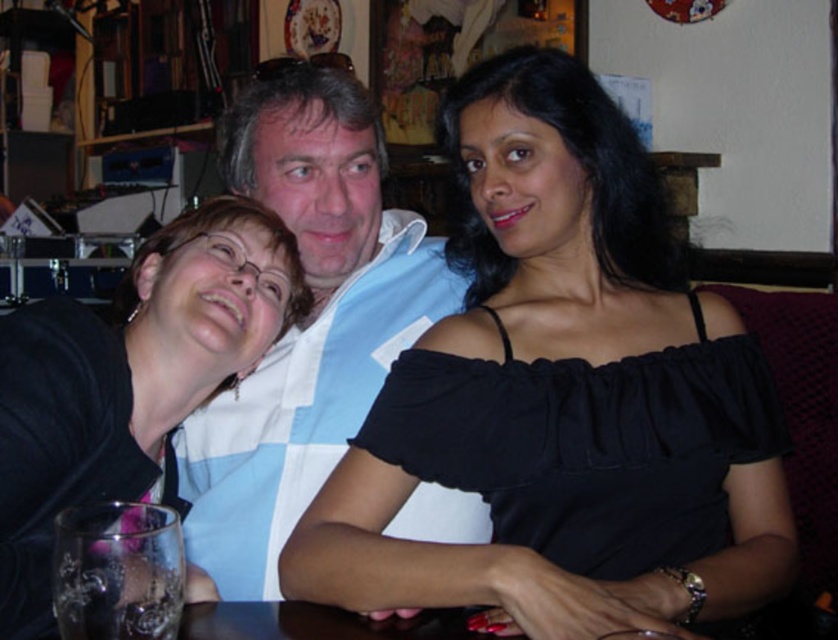
You are a photographer trying to capture a group photo of the black satin blouse at center and the white cotton shirt at center. Since you want to ensure both are visible in the frame, which clothing item should you adjust the camera angle to focus on first?

The black satin blouse at center is shorter than the white cotton shirt at center, so you should focus on the white cotton shirt at center first to ensure its full height is captured in the frame.

You are a photographer trying to capture a group photo of the three people. The camera you are using has a limited depth of field, so you can only focus on one object at a time. If you want to ensure the white cotton shirt at center and the black matte glass at left are both in focus, which object should you focus on and why?

You should focus on the white cotton shirt at center because it is much taller than the black matte glass at left, so focusing on the farther object will help both be in focus.